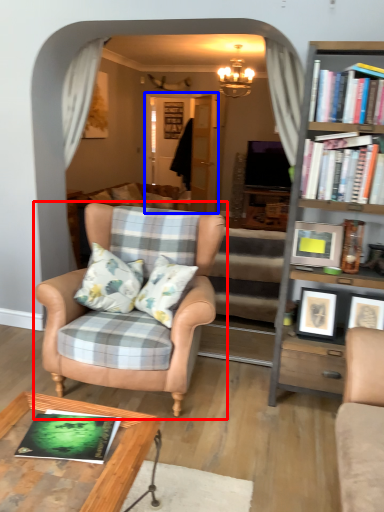
Question: Which point is closer to the camera, chair (highlighted by a red box) or glass door (highlighted by a blue box)?

Choices:
 (A) chair
 (B) glass door

Answer: (A)